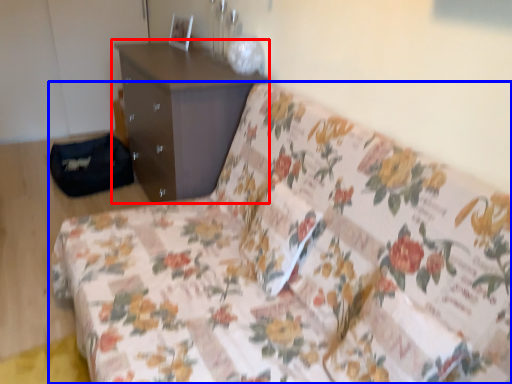
Question: Which object is further to the camera taking this photo, chest of drawers (highlighted by a red box) or studio couch (highlighted by a blue box)?

Choices:
 (A) chest of drawers
 (B) studio couch

Answer: (A)